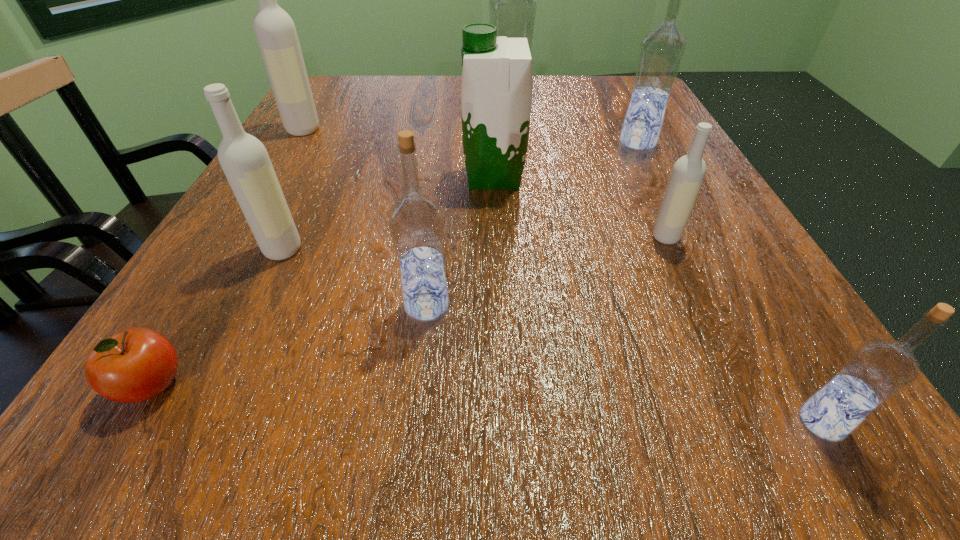
Identify the location of free point between the tallest vodka and the biggest white vodka. This screenshot has width=960, height=540. (406, 122).

At what (x,y) coordinates should I click in order to perform the action: click on vacant space that's between the seventh farthest object and the apple. Please return your answer as a coordinate pair (x, y). This screenshot has height=540, width=960. Looking at the image, I should click on (290, 345).

Where is `free area in between the second farthest blue vodka and the biggest blue vodka`? free area in between the second farthest blue vodka and the biggest blue vodka is located at coordinates (573, 129).

Image resolution: width=960 pixels, height=540 pixels. I want to click on vacant region between the biggest white vodka and the third biggest blue vodka, so click(x=365, y=217).

Where is `vacant region between the farthest white vodka and the sixth vodka from right to left`? This screenshot has height=540, width=960. vacant region between the farthest white vodka and the sixth vodka from right to left is located at coordinates (293, 190).

Locate an element on the screen. The width and height of the screenshot is (960, 540). blank region between the tallest vodka and the farthest white vodka is located at coordinates (406, 122).

Locate an element on the screen. object that is the seventh closest one to the tallest object is located at coordinates (137, 364).

Choose which object is the seventh nearest neighbor to the tallest object. Please provide its 2D coordinates. Your answer should be formatted as a tuple, i.e. [(x, y)], where the tuple contains the x and y coordinates of a point satisfying the conditions above.

[(137, 364)]

Where is `vodka that stands as the fourth closest to the nearest vodka`? vodka that stands as the fourth closest to the nearest vodka is located at coordinates pyautogui.click(x=246, y=164).

You are a GUI agent. You are given a task and a screenshot of the screen. Output one action in this format:
    pyautogui.click(x=<x>, y=<y>)
    Task: Click on the vodka that stands as the second closest to the green soya milk
    
    Given the screenshot: What is the action you would take?
    pyautogui.click(x=661, y=53)